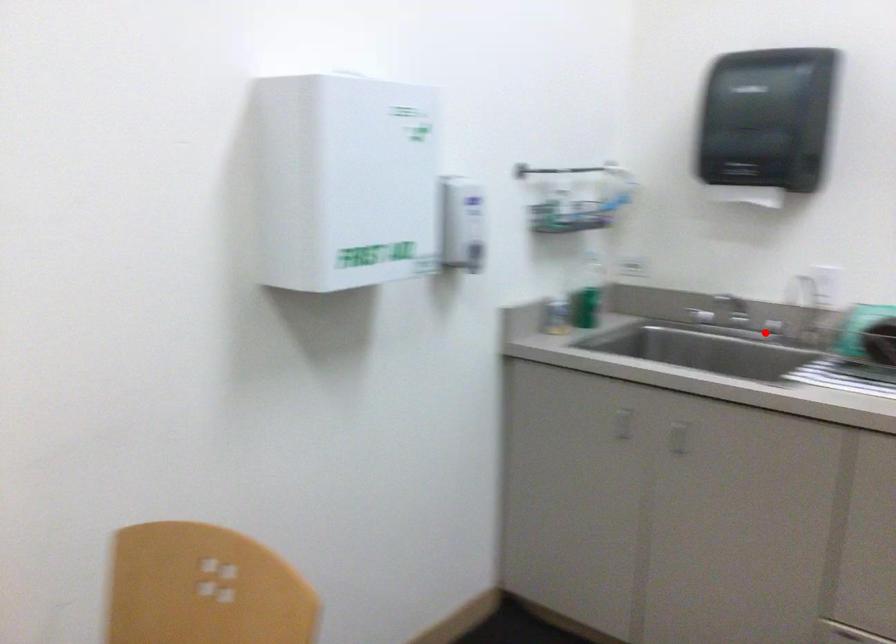
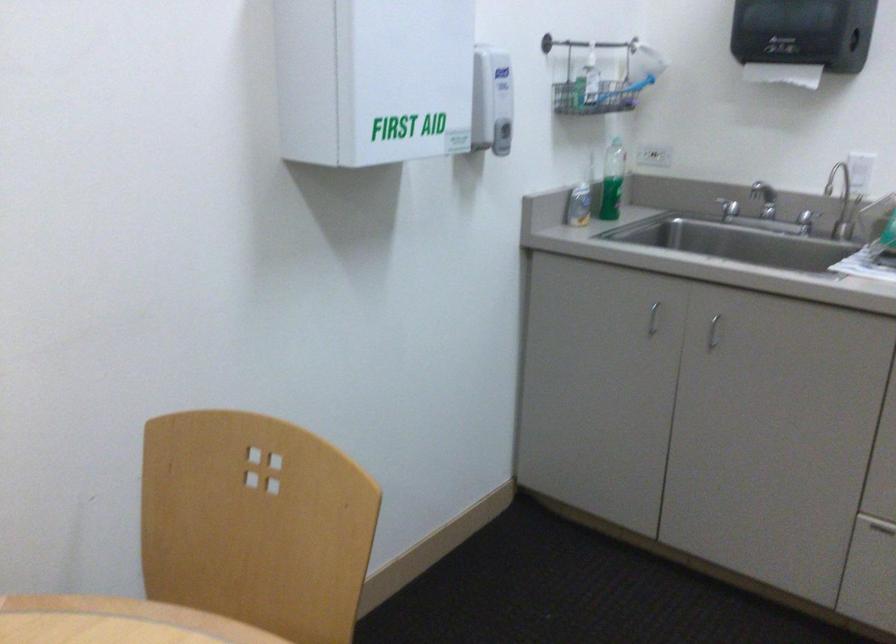
Question: I am providing you with two images of the same scene from different viewpoints. A red point is marked on the first image. Can you still see the location of the red point in image 2?

Choices:
 (A) Yes
 (B) No

Answer: (A)